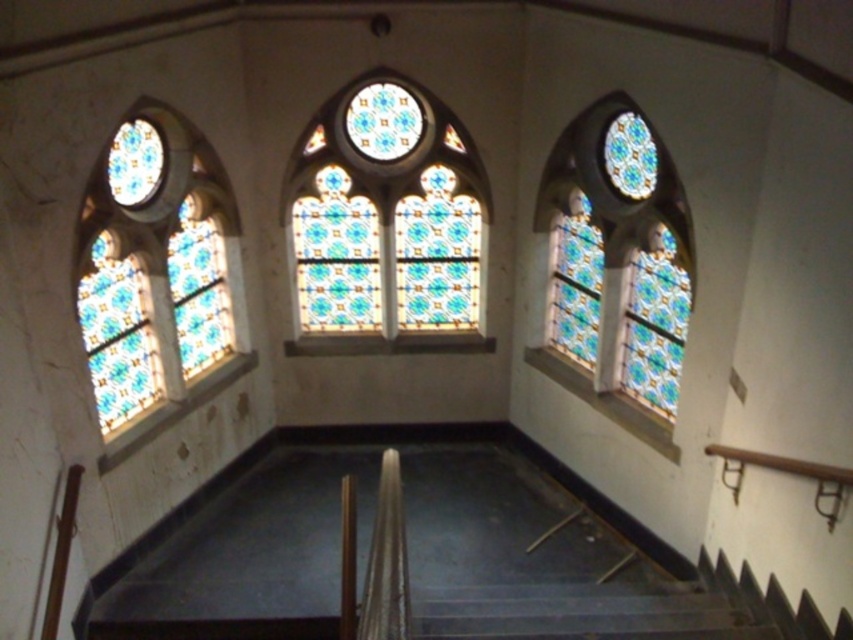
Is stained glass at left in front of stained glass at center?

Yes, it is in front of stained glass at center.

Is stained glass at left further to camera compared to stained glass at center?

No, stained glass at left is closer to the viewer.

Which is behind, point (74, 253) or point (451, 209)?

The point (451, 209) is more distant.

At what (x,y) coordinates should I click in order to perform the action: click on stained glass at left. Please return your answer as a coordinate pair (x, y). The height and width of the screenshot is (640, 853). Looking at the image, I should click on (158, 276).

Between stained glass at left and stained glass at right, which one is positioned lower?

Positioned lower is stained glass at left.

Identify the location of stained glass at left. (158, 276).

Which is behind, point (125, 145) or point (552, 156)?

The point (552, 156) is behind.

At what (x,y) coordinates should I click in order to perform the action: click on stained glass at left. Please return your answer as a coordinate pair (x, y). The height and width of the screenshot is (640, 853). Looking at the image, I should click on (158, 276).

Which is below, stained glass at center or stained glass at right?

Positioned lower is stained glass at right.

Who is more distant from viewer, (445, 152) or (662, 376)?

Positioned behind is point (445, 152).

Where is `stained glass at center`? The image size is (853, 640). stained glass at center is located at coordinates (387, 212).